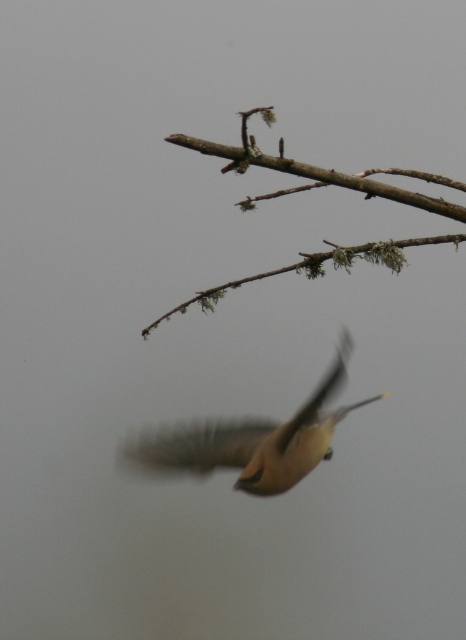
Consider the image. You are a photographer trying to capture the brown feathered bird at center and the brown mossy branch at upper center in the same frame. Which object would require a wider angle lens to ensure both are fully visible in the photo?

The brown mossy branch at upper center requires a wider angle lens because it occupies more space in the frame than the brown feathered bird at center.

You are observing a bird in flight near two points in the image. The first point is at coordinates point (173, 442) and the second is at point (191, 136). Which of these points is closer to you?

Point (173, 442) is closer to you because it is further to the viewer than point (191, 136).

You are an ornithologist analyzing the flight path of the brown feathered bird at center. Based on its position coordinates, can you determine whether it is flying towards the branch in the upper right corner of the image?

The brown feathered bird at center is positioned at coordinates point [254,440]. Since the branch extends diagonally from the upper right corner towards the center, the bird is located closer to the center than the branch, so it is likely flying away from the branch in the upper right corner.